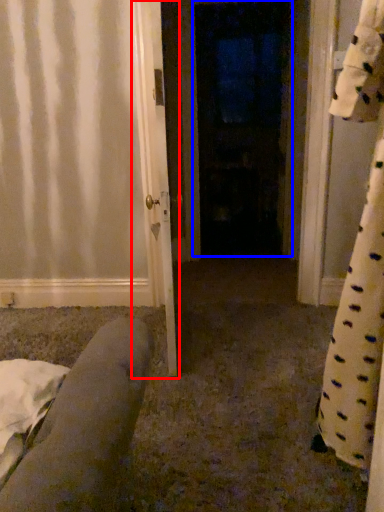
Question: Which of the following is the closest to the observer, door (highlighted by a red box) or door (highlighted by a blue box)?

Choices:
 (A) door
 (B) door

Answer: (A)